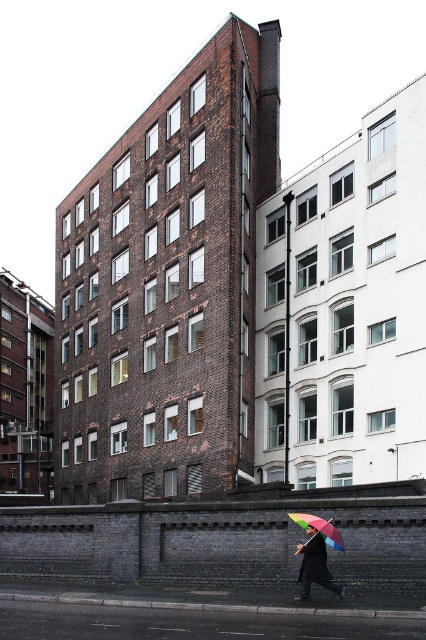
You are a delivery person carrying a package that is 1 meter long. You need to navigate between the rainbow umbrella at lower center and the rainbow fabric umbrella at lower right. Can you pass through the space between them without tilting the package?

The distance between the rainbow umbrella at lower center and the rainbow fabric umbrella at lower right is 92.99 centimeters. Since the package is 1 meter long, which is longer than the available space, you cannot pass through without tilting the package.

You are standing in the urban scene described. You see a rainbow umbrella at lower center and a rainbow fabric umbrella at lower right. Which umbrella is positioned more to the right?

The rainbow umbrella at lower center is positioned more to the right than the rainbow fabric umbrella at lower right.

You are standing at the center of the urban scene and see two points marked in the image. Which point is closer to you, point (x=304, y=579) or point (x=299, y=524)?

Point (x=304, y=579) is in front of point (x=299, y=524), so it is closer to you.